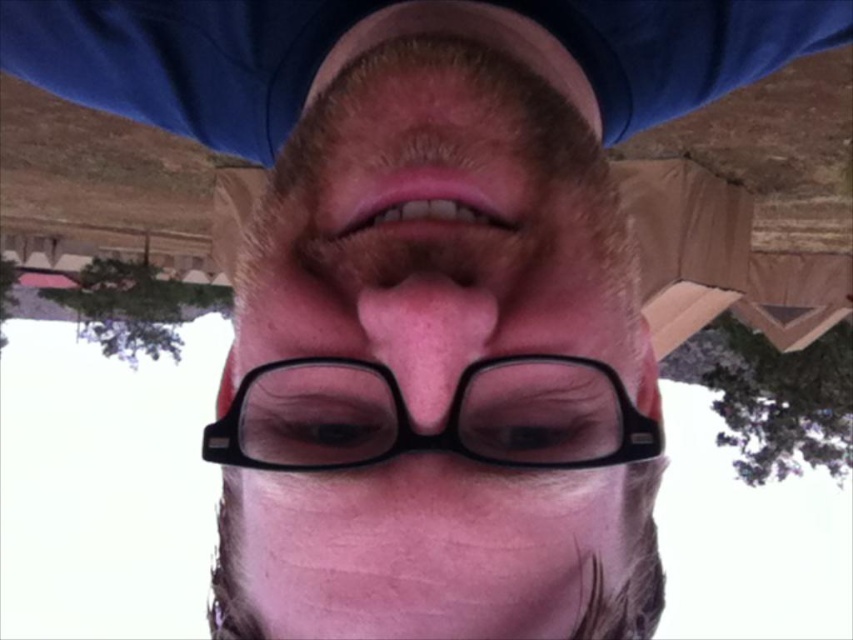
Question: Can you confirm if pink matte nose at center is wider than clear plastic eye at center?

Choices:
 (A) no
 (B) yes

Answer: (A)

Question: Which point is farther to the camera?

Choices:
 (A) clear plastic eye at center
 (B) black plastic glasses at center
 (C) pink matte lips at center

Answer: (C)

Question: Which object is the closest to the clear plastic eye at center?

Choices:
 (A) pink matte lips at center
 (B) pink matte nose at center
 (C) black plastic glasses at center
 (D) black matte glasses at center

Answer: (C)

Question: Does pink matte nose at center appear on the right side of pink matte lips at center?

Choices:
 (A) yes
 (B) no

Answer: (A)

Question: Which point is farther to the camera?

Choices:
 (A) coord(347,211)
 (B) coord(451,305)

Answer: (A)

Question: Is black plastic glasses at center closer to camera compared to pink matte nose at center?

Choices:
 (A) yes
 (B) no

Answer: (B)